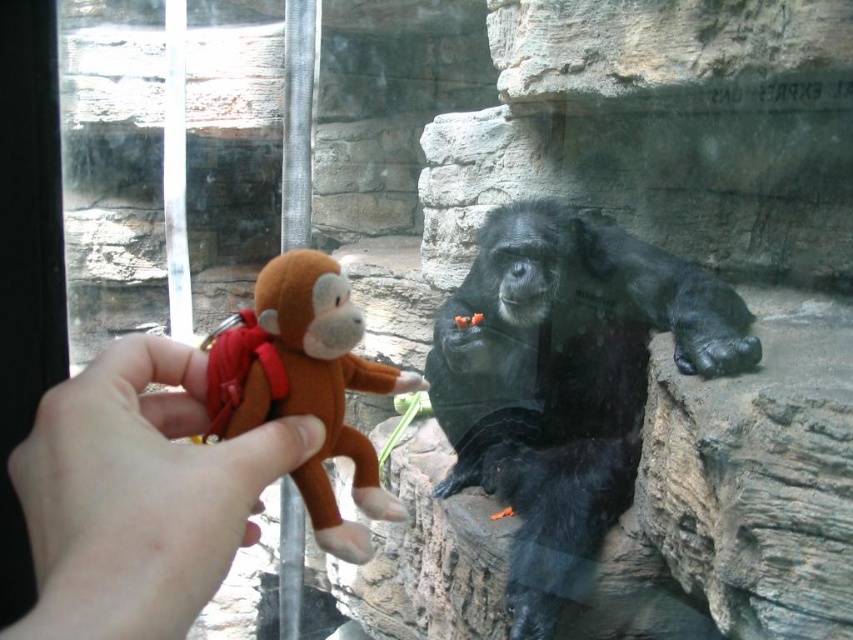
You are a zookeeper who wants to place two brown plush monkeys in the enclosure for an animal enrichment activity. The enclosure has a glass barrier. According to the scene, where should you position the brown plush monkey at center and the brown plush monkey at left relative to each other?

The brown plush monkey at center should be placed to the right of the brown plush monkey at left.

You are a zookeeper who needs to place the brown plush toy at left and the brown plush monkey at left on a shelf. The shelf is 4 inches wide. Can both items fit side by side on the shelf without overlapping?

The distance between the brown plush toy at left and brown plush monkey at left is 3.57 inches. Since the shelf is 4 inches wide, both items can fit side by side with a small gap between them.